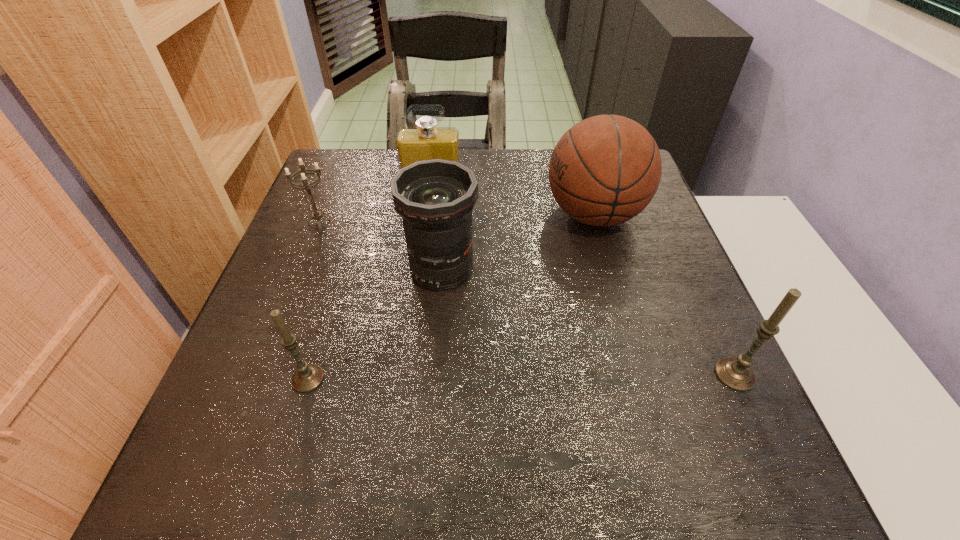
Where is `vacant space at the far left corner`? This screenshot has height=540, width=960. vacant space at the far left corner is located at coordinates (334, 159).

You are a GUI agent. You are given a task and a screenshot of the screen. Output one action in this format:
    pyautogui.click(x=<x>, y=<y>)
    Task: Click on the free space at the near left corner
    The height and width of the screenshot is (540, 960).
    Given the screenshot: What is the action you would take?
    pyautogui.click(x=222, y=407)

Where is `free spot at the near right corner of the desktop`? The width and height of the screenshot is (960, 540). free spot at the near right corner of the desktop is located at coordinates (737, 399).

Where is `unoccupied area between the telephoto lens and the second object from right to left`? The image size is (960, 540). unoccupied area between the telephoto lens and the second object from right to left is located at coordinates (517, 242).

You are a GUI agent. You are given a task and a screenshot of the screen. Output one action in this format:
    pyautogui.click(x=<x>, y=<y>)
    Task: Click on the vacant region between the rightmost object and the left candle
    
    Given the screenshot: What is the action you would take?
    pyautogui.click(x=521, y=376)

Locate an element on the screen. The image size is (960, 540). empty space between the telephoto lens and the fifth object from right to left is located at coordinates (x=374, y=324).

This screenshot has width=960, height=540. Find the location of `vacant space that is in between the taller candle and the perfume`. vacant space that is in between the taller candle and the perfume is located at coordinates (584, 282).

Locate an element on the screen. This screenshot has width=960, height=540. free space between the left candle and the telephoto lens is located at coordinates (374, 324).

The image size is (960, 540). I want to click on vacant area that lies between the second object from right to left and the telephoto lens, so click(517, 242).

Identify the location of free spot between the shortest object and the perfume. (376, 206).